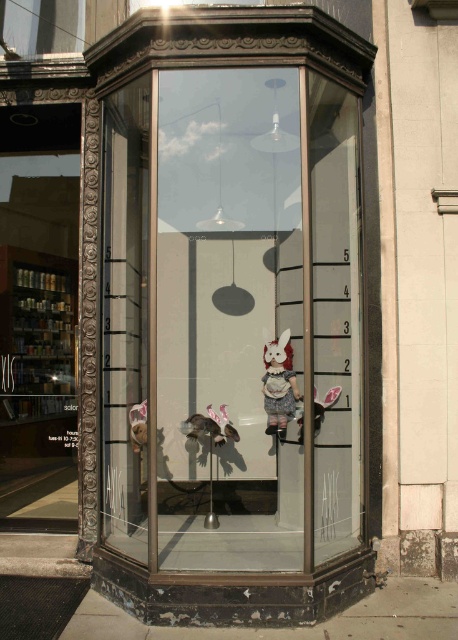
Can you confirm if transparent glass door at center is taller than matte fabric doll at center?

Indeed, transparent glass door at center has a greater height compared to matte fabric doll at center.

Is transparent glass door at center positioned behind matte fabric doll at center?

No, it is in front of matte fabric doll at center.

The height and width of the screenshot is (640, 458). Find the location of `transparent glass door at center`. transparent glass door at center is located at coordinates (230, 317).

Who is more distant from viewer, (60, 353) or (287, 387)?

The point (60, 353) is behind.

At what (x,y) coordinates should I click in order to perform the action: click on clear glass shelves at left. Please return your answer as a coordinate pair (x, y). Looking at the image, I should click on (37, 333).

Who is positioned more to the left, clear glass window at upper left or white plush rabbit at center?

Positioned to the left is clear glass window at upper left.

Between point (26, 33) and point (303, 436), which one is positioned in front?

Positioned in front is point (303, 436).

Find the location of a particular element. The width and height of the screenshot is (458, 640). clear glass window at upper left is located at coordinates (42, 26).